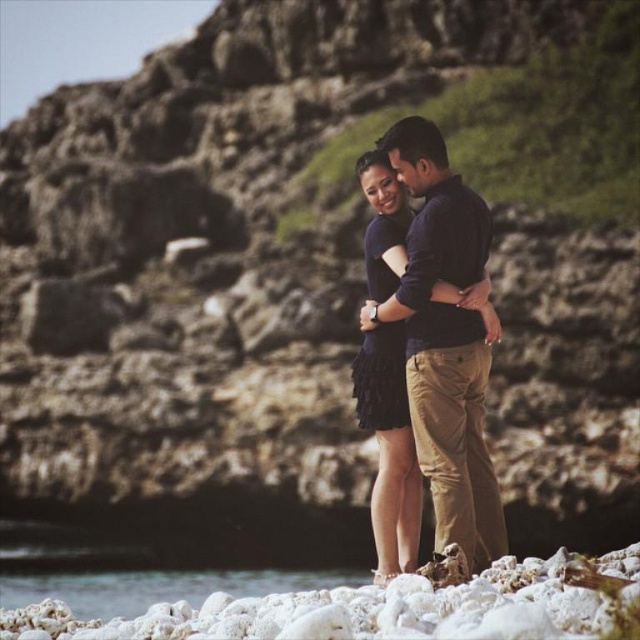
Between point (484, 340) and point (308, 586), which one is positioned behind?

The point (308, 586) is more distant.

Which is below, dark blue cotton shirt at center or white sand at lower left?

Positioned lower is white sand at lower left.

This screenshot has width=640, height=640. What do you see at coordinates (445, 340) in the screenshot? I see `dark blue cotton shirt at center` at bounding box center [445, 340].

The height and width of the screenshot is (640, 640). Find the location of `dark blue cotton shirt at center`. dark blue cotton shirt at center is located at coordinates (445, 340).

Can you confirm if white coral rocks at lower center is positioned above white sand at lower left?

Correct, white coral rocks at lower center is located above white sand at lower left.

Describe the element at coordinates (384, 605) in the screenshot. I see `white coral rocks at lower center` at that location.

Locate an element on the screen. white coral rocks at lower center is located at coordinates (384, 605).

Where is `white coral rocks at lower center`? white coral rocks at lower center is located at coordinates (384, 605).

Is white coral rocks at lower center positioned before dark blue cotton shirt at center?

Yes, it is.

Between point (637, 568) and point (428, 237), which one is positioned in front?

Point (637, 568) is more forward.

The width and height of the screenshot is (640, 640). Identify the location of white coral rocks at lower center. (384, 605).